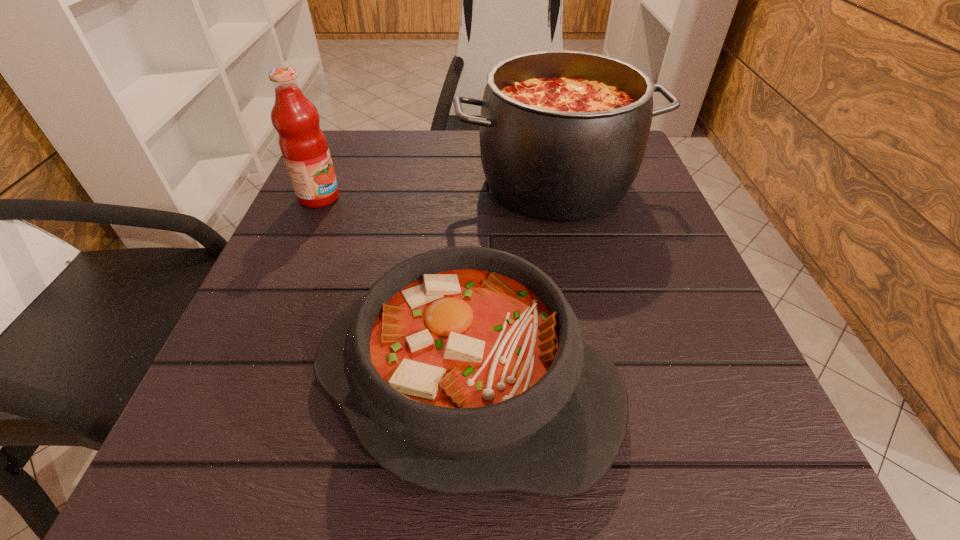
I want to click on vacant space at the near left corner, so click(x=267, y=467).

Locate an element on the screen. This screenshot has height=540, width=960. free space at the near right corner of the desktop is located at coordinates (780, 461).

I want to click on free point between the taller casserole and the fruit juice, so click(437, 190).

Locate an element on the screen. Image resolution: width=960 pixels, height=540 pixels. vacant area between the leftmost object and the farther casserole is located at coordinates (437, 190).

Find the location of a particular element. The image size is (960, 540). vacant point located between the leftmost object and the taller casserole is located at coordinates (437, 190).

Image resolution: width=960 pixels, height=540 pixels. I want to click on vacant region between the farther casserole and the leftmost object, so click(x=437, y=190).

Locate an element on the screen. object identified as the second closest to the taller casserole is located at coordinates (303, 145).

Locate an element on the screen. The height and width of the screenshot is (540, 960). the closest object to the nearer casserole is located at coordinates (563, 134).

Image resolution: width=960 pixels, height=540 pixels. In order to click on blank space that satisfies the following two spatial constraints: 1. on the front side of the taller casserole; 2. on the front label of the fruit juice in this screenshot , I will do `click(558, 197)`.

This screenshot has width=960, height=540. Identify the location of blank space that satisfies the following two spatial constraints: 1. on the front label of the leftmost object; 2. on the right side of the shortest object. (237, 383).